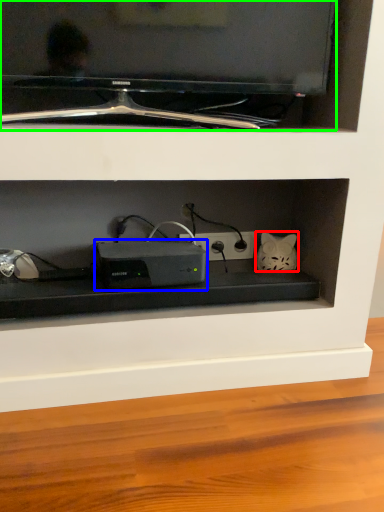
Question: Which object is positioned closest to cat (highlighted by a red box)? Select from appliance (highlighted by a blue box) and television (highlighted by a green box).

Choices:
 (A) appliance
 (B) television

Answer: (A)